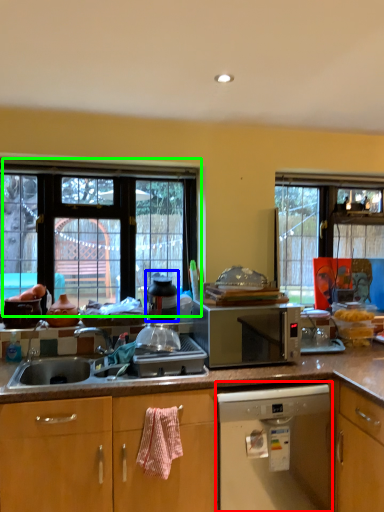
Question: Estimate the real-world distances between objects in this image. Which object is farther from home appliance (highlighted by a red box), appliance (highlighted by a blue box) or window (highlighted by a green box)?

Choices:
 (A) appliance
 (B) window

Answer: (B)